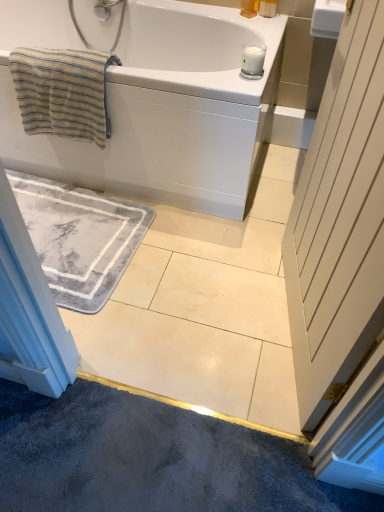
This screenshot has height=512, width=384. In order to click on unoccupied space behind white wooden door at right in this screenshot , I will do `click(239, 242)`.